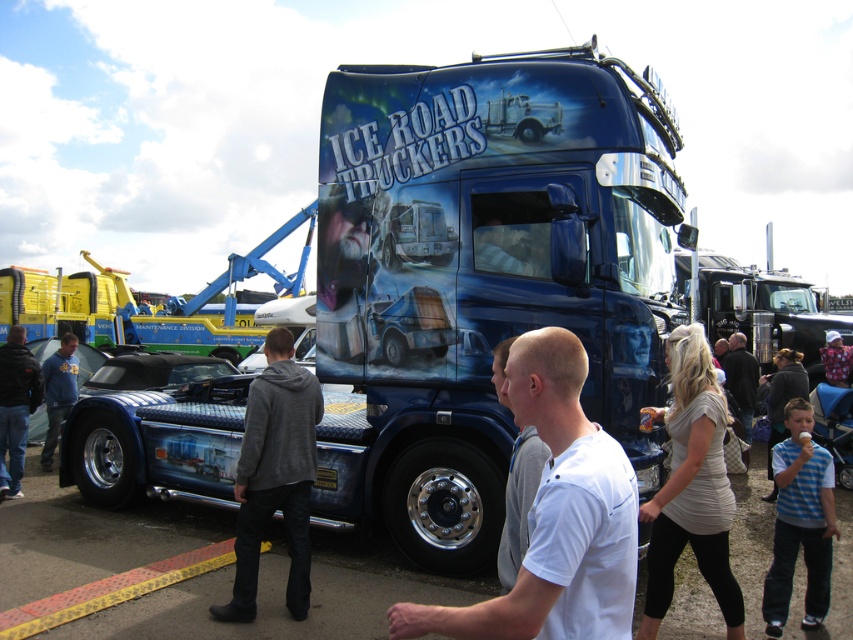
Between dark gray hoodie at left and dark gray sweater at center, which one is positioned higher?

dark gray hoodie at left is higher up.

Is point (16, 355) farther from camera compared to point (734, 348)?

That is False.

Between point (12, 481) and point (750, 394), which one is positioned in front?

Point (12, 481) is more forward.

What are the coordinates of `dark gray hoodie at left` in the screenshot? It's located at (15, 406).

Who is taller, glossy metallic truck at center or blue hoodie at left?

glossy metallic truck at center

Find the location of a particular element. This screenshot has width=853, height=640. glossy metallic truck at center is located at coordinates (482, 276).

Consider the image. Who is more distant from viewer, (553,292) or (53,406)?

Positioned behind is point (53,406).

Identify the location of glossy metallic truck at center. (482, 276).

In the scene shown: Can you confirm if glossy metallic truck at center is wider than dark gray hoodie at left?

Indeed, glossy metallic truck at center has a greater width compared to dark gray hoodie at left.

Image resolution: width=853 pixels, height=640 pixels. What do you see at coordinates (482, 276) in the screenshot? I see `glossy metallic truck at center` at bounding box center [482, 276].

Which is behind, point (412, 483) or point (0, 372)?

Point (0, 372)

Find the location of `glossy metallic truck at center`. glossy metallic truck at center is located at coordinates (482, 276).